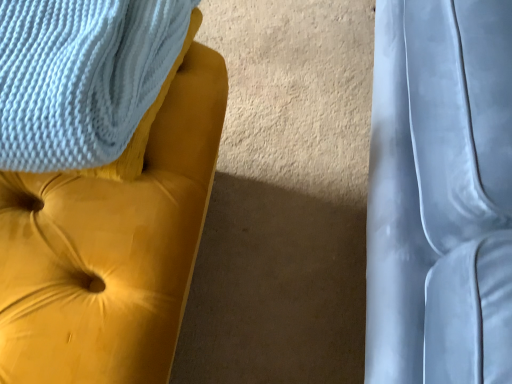
Describe the element at coordinates (112, 242) in the screenshot. This screenshot has width=512, height=384. I see `velvet yellow couch at left` at that location.

Measure the distance between point (97, 170) and camera.

20.24 inches.

Where is `velvet yellow couch at left`? The height and width of the screenshot is (384, 512). velvet yellow couch at left is located at coordinates [112, 242].

At what (x,y) coordinates should I click in order to perform the action: click on velvet yellow couch at left. Please return your answer as a coordinate pair (x, y). Looking at the image, I should click on (112, 242).